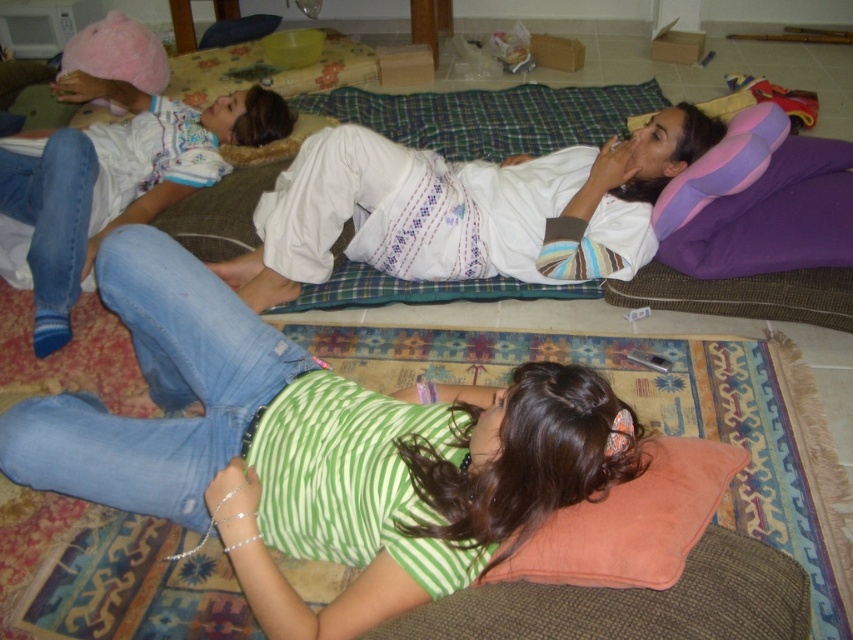
Does green striped shirt at lower center appear under orange velvety pillow at lower center?

Incorrect, green striped shirt at lower center is not positioned below orange velvety pillow at lower center.

Is green striped shirt at lower center wider than orange velvety pillow at lower center?

Yes.

The height and width of the screenshot is (640, 853). In order to click on green striped shirt at lower center in this screenshot , I will do `click(305, 445)`.

Does white cotton shirt at center lie in front of purple/pink foam pillow at upper right?

No, white cotton shirt at center is behind purple/pink foam pillow at upper right.

Which is behind, point (515, 211) or point (737, 163)?

The point (515, 211) is more distant.

Find the location of a particular element. The width and height of the screenshot is (853, 640). white cotton shirt at center is located at coordinates (465, 209).

Identify the location of white cotton shirt at center. This screenshot has height=640, width=853. (465, 209).

Is pink fuzzy hat at upper left wider than orange velvety pillow at lower center?

Indeed, pink fuzzy hat at upper left has a greater width compared to orange velvety pillow at lower center.

Looking at this image, is the position of pink fuzzy hat at upper left less distant than that of orange velvety pillow at lower center?

No, pink fuzzy hat at upper left is behind orange velvety pillow at lower center.

At what (x,y) coordinates should I click in order to perform the action: click on pink fuzzy hat at upper left. Please return your answer as a coordinate pair (x, y). Looking at the image, I should click on (114, 179).